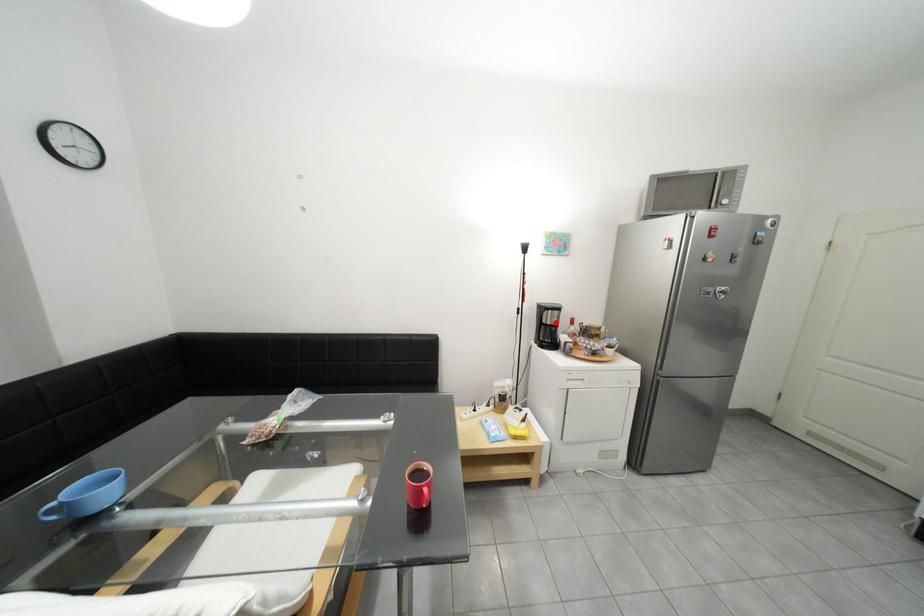
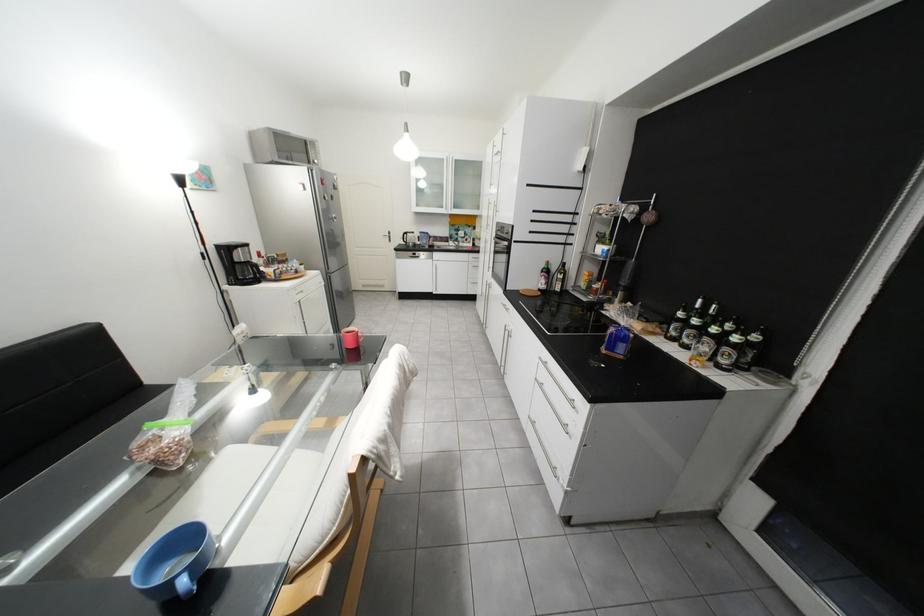
The point at the highlighted location is marked in the first image. Where is the corresponding point in the second image?

(249, 262)